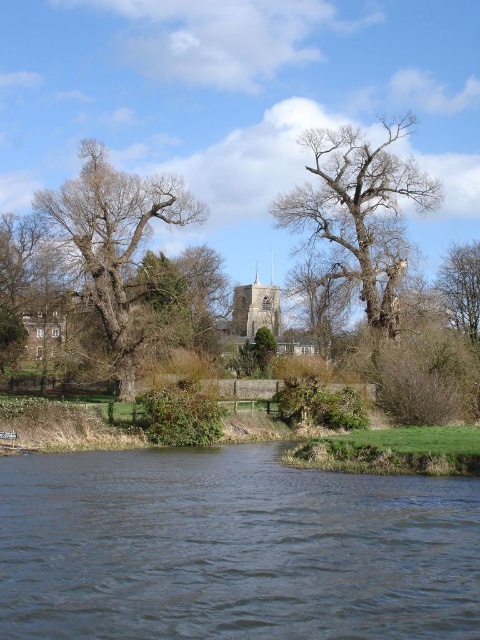
Is smooth bark tree at left positioned behind brown textured tree at upper right?

No.

Between point (204, 209) and point (471, 304), which one is positioned in front?

Point (204, 209) is in front.

The height and width of the screenshot is (640, 480). I want to click on smooth bark tree at left, so click(115, 243).

Locate an element on the screen. The width and height of the screenshot is (480, 640). bare wood tree at upper center is located at coordinates [360, 211].

Who is lower down, bare wood tree at upper center or brown textured tree at upper right?

brown textured tree at upper right

I want to click on bare wood tree at upper center, so click(x=360, y=211).

Locate an element on the screen. bare wood tree at upper center is located at coordinates (360, 211).

Is point (265, 563) closer to camera compared to point (91, 170)?

That is True.

Is dark blue water at center further to the viewer compared to smooth bark tree at left?

No, it is not.

This screenshot has height=640, width=480. Find the location of `dark blue water at center`. dark blue water at center is located at coordinates (231, 548).

Locate an element on the screen. The width and height of the screenshot is (480, 640). dark blue water at center is located at coordinates (231, 548).